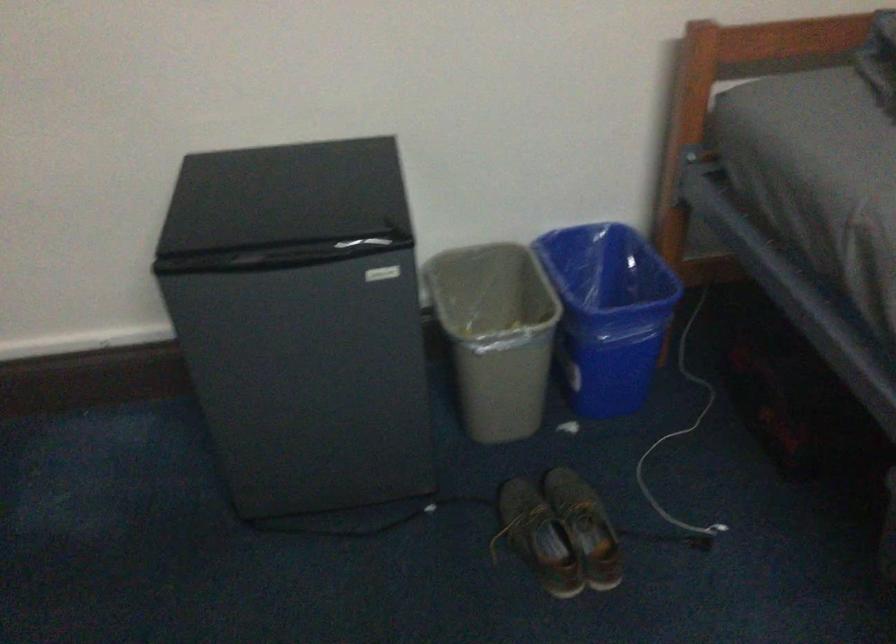
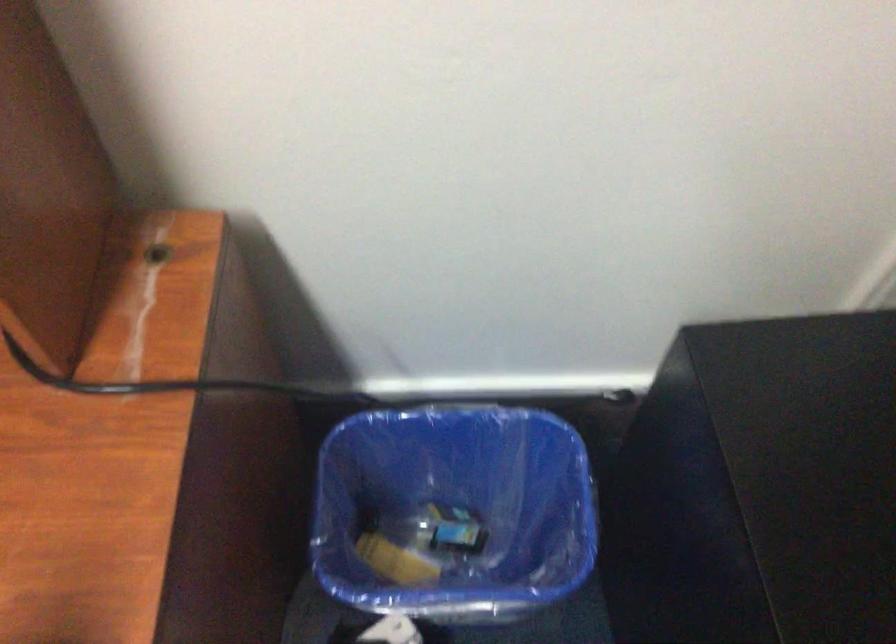
The first image is from the beginning of the video and the second image is from the end. How did the camera likely rotate when shooting the video?

The camera rotated toward left-down.